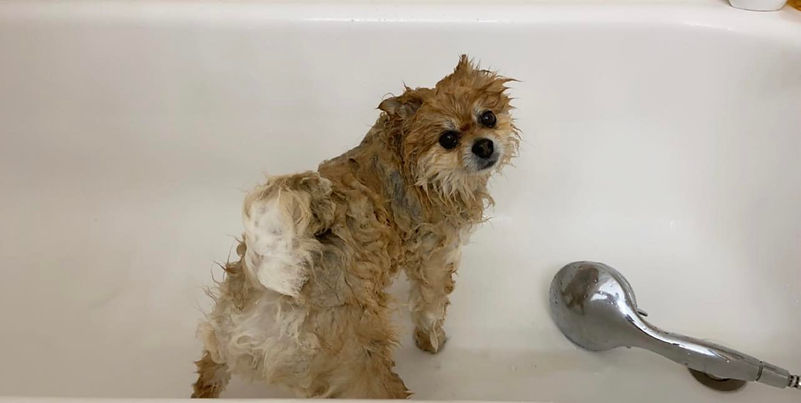
You are a GUI agent. You are given a task and a screenshot of the screen. Output one action in this format:
    pyautogui.click(x=<x>, y=<y>)
    Task: Click on the showerhead
    The width and height of the screenshot is (801, 403).
    Given the screenshot: What is the action you would take?
    608,313